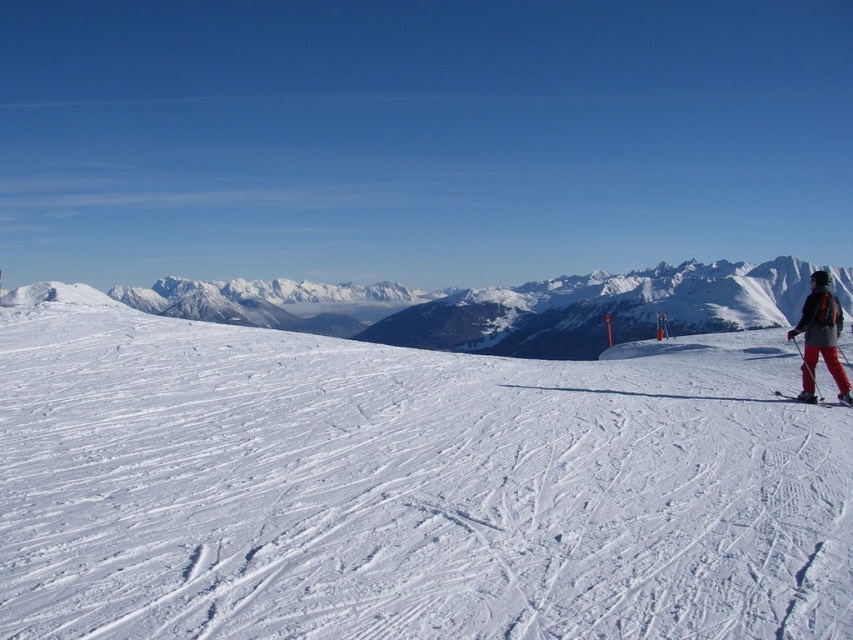
You are a photographer trying to capture a photo of the red ski pants at right and the white powdery snow at center. Your camera has a maximum focus range of 20 meters. Can you take a photo of both objects in focus at the same time?

The white powdery snow at center and red ski pants at right are 20.86 meters apart from each other. Since the camera can only focus up to 20 meters, the distance between them exceeds the camera s maximum focus range. Therefore, you cannot take a photo of both objects in focus simultaneously.

You are a photographer at the ski resort. You want to take a photo of the red ski pants at right and the matte red ski at lower right. Which object should you focus on first if you want to capture both in the same frame without moving the camera?

The red ski pants at right is much taller than the matte red ski at lower right, so you should focus on the red ski pants at right first to ensure it is in focus since it is larger in the frame.

You are a photographer planning to take a photo of the red ski pants at right and the matte red ski at lower right. Which object should you focus on first if you want to capture both in the same frame without moving the camera?

The red ski pants at right is positioned on the right side of matte red ski at lower right, so you should focus on the matte red ski at lower right first to ensure both objects are in the frame.